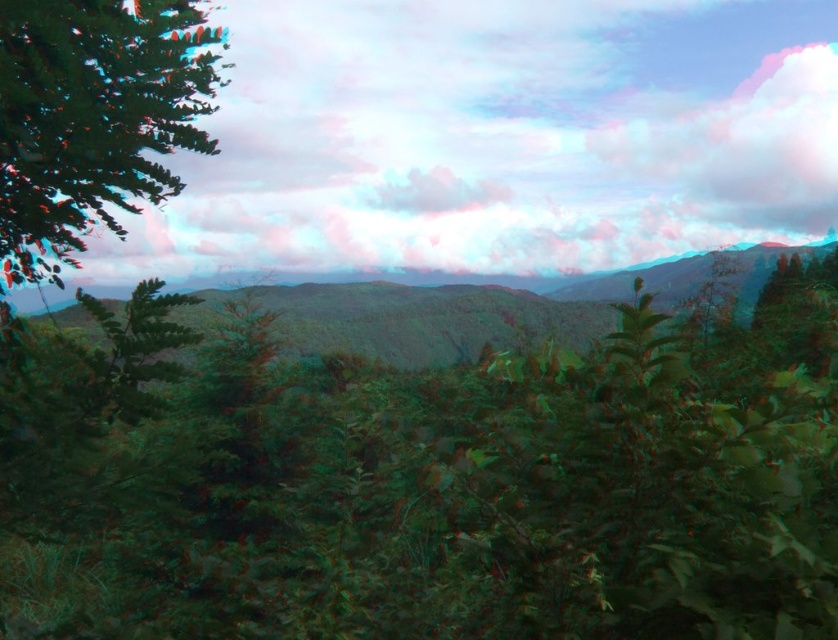
Question: Is green matte leaves at upper left further to the viewer compared to green leafy mountain at center?

Choices:
 (A) no
 (B) yes

Answer: (A)

Question: Which object is farther from the camera taking this photo?

Choices:
 (A) green matte leaves at upper left
 (B) green leafy mountain at center

Answer: (B)

Question: Which of the following is the closest to the observer?

Choices:
 (A) green leafy mountain at center
 (B) green matte leaves at upper left

Answer: (B)

Question: Does green matte leaves at upper left appear on the left side of green leafy mountain at center?

Choices:
 (A) yes
 (B) no

Answer: (A)

Question: Does green matte leaves at upper left appear on the left side of green leafy mountain at center?

Choices:
 (A) yes
 (B) no

Answer: (A)